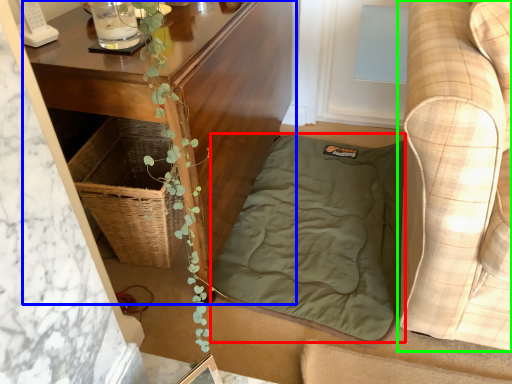
Question: Which is farther away from blanket (highlighted by a red box)? table (highlighted by a blue box) or studio couch (highlighted by a green box)?

Choices:
 (A) table
 (B) studio couch

Answer: (B)